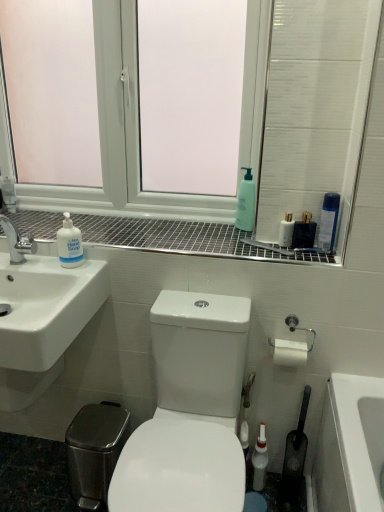
Identify the location of free spot in front of clear plastic spray bottle at upper right, the second cleaning product positioned from the left. (317, 258).